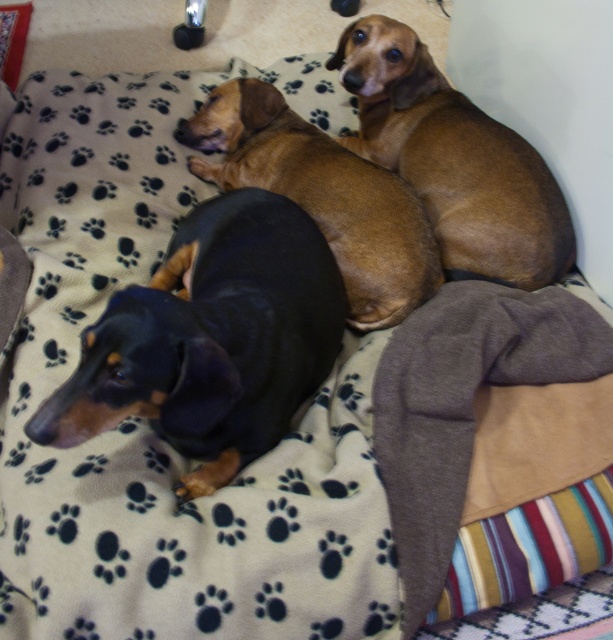
You are a dog owner who wants to buy a new dog bed. The current bed has space for two dogs. You see the black smooth dog at left and the brown smooth dog at upper right. Which dog requires a larger bed size?

The black smooth dog at left requires a larger bed size because it is bigger than the brown smooth dog at upper right.

You are a dog owner who wants to buy a new blanket for the bed where the black smooth dog at left and brown smooth dog at upper center are resting. The new blanket must be wide enough to accommodate both dogs. Based on their sizes, what should you consider when choosing the blanket width?

The black smooth dog at left is narrower than the brown smooth dog at upper center. Therefore, the blanket should be wider than the combined width of both dogs to ensure there is enough space for both.

You are standing in front of a bed with three dachshunds. You want to place a treat at point [454,161]. Which dog will the treat land closest to?

The treat placed at point [454,161] will land closest to the brown smooth dog at upper right.